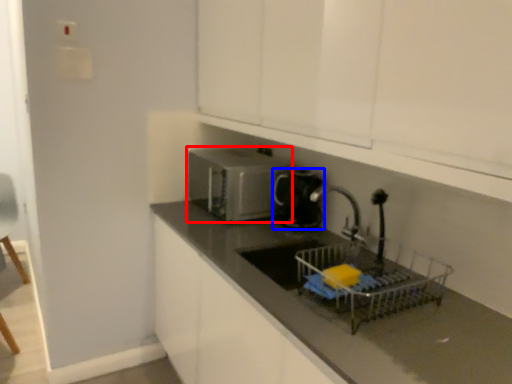
Question: Which object appears closest to the camera in this image, home appliance (highlighted by a red box) or kitchen appliance (highlighted by a blue box)?

Choices:
 (A) home appliance
 (B) kitchen appliance

Answer: (B)